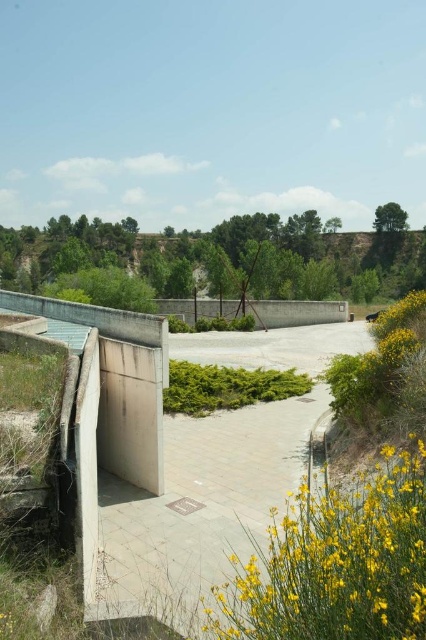
Is yellow matte flowers at lower right shorter than concrete bunker at left?

Yes, yellow matte flowers at lower right is shorter than concrete bunker at left.

Which is behind, point (373, 630) or point (164, 348)?

The point (164, 348) is more distant.

Identify the location of yellow matte flowers at lower right. The image size is (426, 640). (337, 563).

In the scene shown: Between concrete wall at center and yellow matte flowers at lower right, which one is positioned lower?

Positioned lower is concrete wall at center.

Is concrete wall at center closer to camera compared to yellow matte flowers at lower right?

No, concrete wall at center is further to the viewer.

The height and width of the screenshot is (640, 426). Identify the location of concrete wall at center. [x=199, y=508].

Is concrete bunker at left closer to camera compared to green grassy hillside at center?

Yes, it is.

Does concrete bunker at left have a lesser width compared to green grassy hillside at center?

Indeed, concrete bunker at left has a lesser width compared to green grassy hillside at center.

Identify the location of concrete bunker at left. (100, 401).